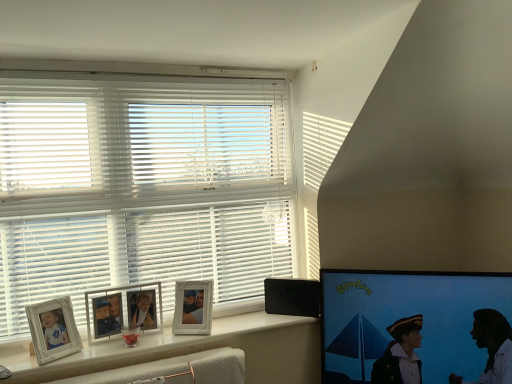
Question: Is black plastic speaker at lower right to the left of matte black screen at right from the viewer's perspective?

Choices:
 (A) no
 (B) yes

Answer: (B)

Question: Is the surface of black plastic speaker at lower right in direct contact with matte black screen at right?

Choices:
 (A) yes
 (B) no

Answer: (B)

Question: From the image's perspective, is black plastic speaker at lower right on matte black screen at right?

Choices:
 (A) no
 (B) yes

Answer: (B)

Question: From a real-world perspective, is black plastic speaker at lower right located beneath matte black screen at right?

Choices:
 (A) yes
 (B) no

Answer: (B)

Question: Is black plastic speaker at lower right wider than matte black screen at right?

Choices:
 (A) no
 (B) yes

Answer: (A)

Question: Based on their sizes in the image, would you say black plastic speaker at lower right is bigger or smaller than white glossy window sill at lower left?

Choices:
 (A) big
 (B) small

Answer: (B)

Question: From the image's perspective, relative to white glossy window sill at lower left, is black plastic speaker at lower right above or below?

Choices:
 (A) below
 (B) above

Answer: (B)

Question: Would you say black plastic speaker at lower right is to the left or to the right of white glossy window sill at lower left in the picture?

Choices:
 (A) right
 (B) left

Answer: (A)

Question: Relative to white glossy window sill at lower left, is black plastic speaker at lower right in front or behind?

Choices:
 (A) behind
 (B) front

Answer: (A)

Question: Does point (389, 339) appear closer or farther from the camera than point (186, 89)?

Choices:
 (A) farther
 (B) closer

Answer: (B)

Question: In the image, is matte black screen at right on the left side or the right side of white matte blinds at upper left?

Choices:
 (A) right
 (B) left

Answer: (A)

Question: Is matte black screen at right taller or shorter than white matte blinds at upper left?

Choices:
 (A) tall
 (B) short

Answer: (B)

Question: Is matte black screen at right inside the boundaries of white matte blinds at upper left, or outside?

Choices:
 (A) outside
 (B) inside

Answer: (A)

Question: From their relative heights in the image, would you say white matte blinds at upper left is taller or shorter than white glossy window sill at lower left?

Choices:
 (A) tall
 (B) short

Answer: (A)

Question: Would you say white matte blinds at upper left is to the left or to the right of white glossy window sill at lower left in the picture?

Choices:
 (A) right
 (B) left

Answer: (B)